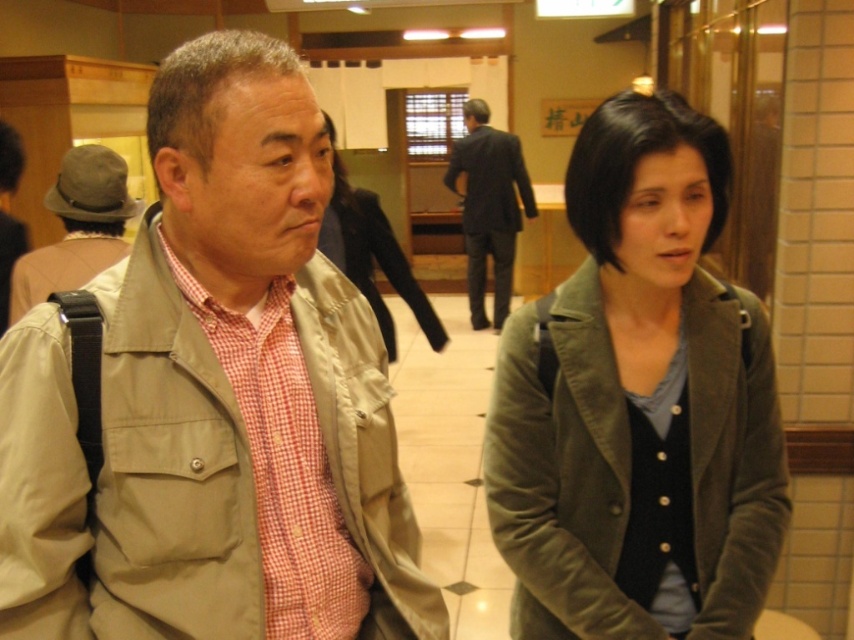
Question: Is khaki fabric jacket at center wider than matte olive green jacket at center?

Choices:
 (A) no
 (B) yes

Answer: (B)

Question: Which object is the farthest from the dark gray wool jacket at center?

Choices:
 (A) matte olive green jacket at center
 (B) matte green jacket at center
 (C) dark gray suit at center
 (D) khaki fabric jacket at center

Answer: (D)

Question: Which of the following is the closest to the observer?

Choices:
 (A) dark gray suit at center
 (B) dark gray wool jacket at center
 (C) khaki fabric jacket at center

Answer: (C)

Question: Based on their relative distances, which object is farther from the khaki fabric jacket at center?

Choices:
 (A) matte khaki jacket at left
 (B) dark gray suit at center

Answer: (B)

Question: Is matte olive green jacket at center above dark gray suit at center?

Choices:
 (A) yes
 (B) no

Answer: (B)

Question: Can you confirm if matte khaki jacket at left is positioned above dark gray suit at center?

Choices:
 (A) yes
 (B) no

Answer: (B)